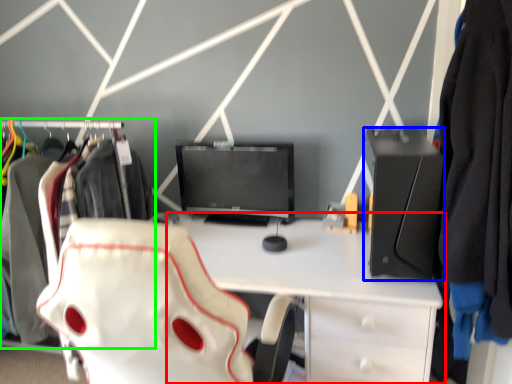
Question: Based on their relative distances, which object is farther from desk (highlighted by a red box)? Choose from desktop (highlighted by a blue box) and closet (highlighted by a green box).

Choices:
 (A) desktop
 (B) closet

Answer: (B)